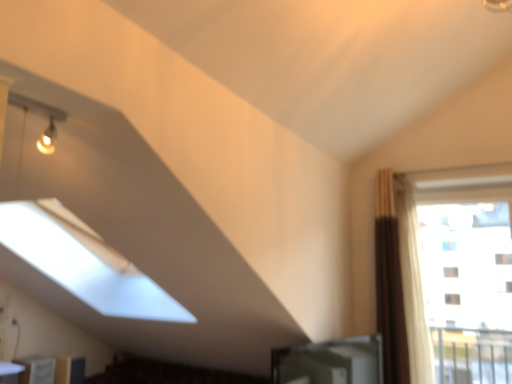
Locate an element on the screen. The image size is (512, 384). matte wood cabinet at lower left, marked as the second furniture in a front-to-back arrangement is located at coordinates (70, 370).

What do you see at coordinates (10, 372) in the screenshot?
I see `white glossy table at lower left` at bounding box center [10, 372].

At what (x,y) coordinates should I click in order to perform the action: click on matte wood cabinet at lower left, marked as the second furniture in a front-to-back arrangement. Please return your answer as a coordinate pair (x, y). The height and width of the screenshot is (384, 512). Looking at the image, I should click on (70, 370).

Could you measure the distance between white glossy bookshelf at lower left, placed as the first furniture when sorted from front to back, and matte wood cabinet at lower left, marked as the second furniture in a front-to-back arrangement?

white glossy bookshelf at lower left, placed as the first furniture when sorted from front to back, is 25.41 inches from matte wood cabinet at lower left, marked as the second furniture in a front-to-back arrangement.

From the image's perspective, between white glossy bookshelf at lower left, placed as the first furniture when sorted from front to back, and matte wood cabinet at lower left, marked as the second furniture in a front-to-back arrangement, who is located below?

matte wood cabinet at lower left, marked as the second furniture in a front-to-back arrangement.

Who is more distant, white glossy bookshelf at lower left, placed as the second furniture when sorted from back to front, or matte wood cabinet at lower left, acting as the first furniture starting from the back?

matte wood cabinet at lower left, acting as the first furniture starting from the back, is further from the camera.

Is white glossy bookshelf at lower left, placed as the second furniture when sorted from back to front, bigger than matte wood cabinet at lower left, acting as the first furniture starting from the back?

Actually, white glossy bookshelf at lower left, placed as the second furniture when sorted from back to front, might be smaller than matte wood cabinet at lower left, acting as the first furniture starting from the back.

Considering the sizes of objects white glossy bookshelf at lower left, placed as the first furniture when sorted from front to back, and transparent glass window at right in the image provided, who is taller, white glossy bookshelf at lower left, placed as the first furniture when sorted from front to back, or transparent glass window at right?

transparent glass window at right is taller.

Looking at this image, choose the correct answer: Is white glossy bookshelf at lower left, placed as the second furniture when sorted from back to front, inside transparent glass window at right or outside it?

white glossy bookshelf at lower left, placed as the second furniture when sorted from back to front, is not inside transparent glass window at right, it's outside.

Does white glossy bookshelf at lower left, placed as the second furniture when sorted from back to front, have a lesser width compared to transparent glass window at right?

Incorrect, the width of white glossy bookshelf at lower left, placed as the second furniture when sorted from back to front, is not less than that of transparent glass window at right.

How different are the orientations of white glossy bookshelf at lower left, placed as the first furniture when sorted from front to back, and transparent glass window at right in degrees?

They differ by 90 degrees in their facing directions.

Is matte wood cabinet at lower left, marked as the second furniture in a front-to-back arrangement, turned away from white glossy bookshelf at lower left, placed as the second furniture when sorted from back to front?

No, white glossy bookshelf at lower left, placed as the second furniture when sorted from back to front, is not at the back of matte wood cabinet at lower left, marked as the second furniture in a front-to-back arrangement.

Which object is positioned more to the right, matte wood cabinet at lower left, acting as the first furniture starting from the back, or white glossy bookshelf at lower left, placed as the second furniture when sorted from back to front?

matte wood cabinet at lower left, acting as the first furniture starting from the back.

Between matte wood cabinet at lower left, marked as the second furniture in a front-to-back arrangement, and white glossy bookshelf at lower left, placed as the first furniture when sorted from front to back, which one has less height?

white glossy bookshelf at lower left, placed as the first furniture when sorted from front to back, is shorter.

From the image's perspective, between matte wood cabinet at lower left, acting as the first furniture starting from the back, and white glossy bookshelf at lower left, placed as the first furniture when sorted from front to back, who is located below?

From the image's view, matte wood cabinet at lower left, acting as the first furniture starting from the back, is below.

Is white glossy table at lower left in contact with matte wood cabinet at lower left, acting as the first furniture starting from the back?

white glossy table at lower left and matte wood cabinet at lower left, acting as the first furniture starting from the back, are clearly separated.

Considering the relative positions of white glossy table at lower left and matte wood cabinet at lower left, marked as the second furniture in a front-to-back arrangement, in the image provided, is white glossy table at lower left to the left or to the right of matte wood cabinet at lower left, marked as the second furniture in a front-to-back arrangement,?

Clearly, white glossy table at lower left is on the left of matte wood cabinet at lower left, marked as the second furniture in a front-to-back arrangement, in the image.

From a real-world perspective, which object stands above the other?

In real-world perspective, white glossy table at lower left is above.

Can you tell me how much brown fabric curtain at right and white glossy bookshelf at lower left, placed as the second furniture when sorted from back to front, differ in facing direction?

They differ by 90 degrees in their facing directions.

Considering the relative sizes of brown fabric curtain at right and white glossy bookshelf at lower left, placed as the first furniture when sorted from front to back, in the image provided, is brown fabric curtain at right thinner than white glossy bookshelf at lower left, placed as the first furniture when sorted from front to back,?

Indeed, brown fabric curtain at right has a lesser width compared to white glossy bookshelf at lower left, placed as the first furniture when sorted from front to back.

Is brown fabric curtain at right positioned before white glossy bookshelf at lower left, placed as the second furniture when sorted from back to front?

No.

Is brown fabric curtain at right next to white glossy bookshelf at lower left, placed as the second furniture when sorted from back to front, and touching it?

brown fabric curtain at right is not next to white glossy bookshelf at lower left, placed as the second furniture when sorted from back to front, and they're not touching.

How different are the orientations of brown fabric curtain at right and matte wood cabinet at lower left, marked as the second furniture in a front-to-back arrangement, in degrees?

They differ by 90 degrees in their facing directions.

Is point (393, 229) closer to viewer compared to point (69, 380)?

Yes, it is.

Is brown fabric curtain at right bigger or smaller than matte wood cabinet at lower left, marked as the second furniture in a front-to-back arrangement?

Clearly, brown fabric curtain at right is larger in size than matte wood cabinet at lower left, marked as the second furniture in a front-to-back arrangement.

Could you tell me if brown fabric curtain at right is facing matte wood cabinet at lower left, acting as the first furniture starting from the back?

No, brown fabric curtain at right is not oriented towards matte wood cabinet at lower left, acting as the first furniture starting from the back.

From the image's perspective, is white glossy bookshelf at lower left, placed as the second furniture when sorted from back to front, beneath brown fabric curtain at right?

Yes.

Can you confirm if white glossy bookshelf at lower left, placed as the second furniture when sorted from back to front, is wider than brown fabric curtain at right?

Yes.

From a real-world perspective, which is physically above, white glossy bookshelf at lower left, placed as the first furniture when sorted from front to back, or brown fabric curtain at right?

From a 3D spatial view, brown fabric curtain at right is above.

Find the location of a particular element. This screenshot has height=384, width=512. furniture above the matte wood cabinet at lower left, acting as the first furniture starting from the back (from a real-world perspective) is located at coordinates (36, 369).

What are the coordinates of `furniture that is the 2nd one when counting leftward from the transparent glass window at right` in the screenshot? It's located at (36, 369).

Considering their positions, is white glossy table at lower left positioned further to brown fabric curtain at right than transparent glass window at right?

white glossy table at lower left is further to brown fabric curtain at right.

Estimate the real-world distances between objects in this image. Which object is further from white glossy bookshelf at lower left, placed as the second furniture when sorted from back to front, matte wood cabinet at lower left, marked as the second furniture in a front-to-back arrangement, or white glossy table at lower left?

matte wood cabinet at lower left, marked as the second furniture in a front-to-back arrangement, is positioned further to the anchor white glossy bookshelf at lower left, placed as the second furniture when sorted from back to front.

Which object lies nearer to the anchor point white glossy bookshelf at lower left, placed as the second furniture when sorted from back to front, brown fabric curtain at right or matte wood cabinet at lower left, marked as the second furniture in a front-to-back arrangement?

Among the two, matte wood cabinet at lower left, marked as the second furniture in a front-to-back arrangement, is located nearer to white glossy bookshelf at lower left, placed as the second furniture when sorted from back to front.

Looking at the image, which one is located closer to transparent glass window at right, white glossy table at lower left or matte wood cabinet at lower left, acting as the first furniture starting from the back?

The object closer to transparent glass window at right is matte wood cabinet at lower left, acting as the first furniture starting from the back.

Considering their positions, is transparent glass window at right positioned further to white glossy table at lower left than white glossy bookshelf at lower left, placed as the second furniture when sorted from back to front?

transparent glass window at right is further to white glossy table at lower left.

Looking at the image, which one is located closer to white glossy bookshelf at lower left, placed as the second furniture when sorted from back to front, brown fabric curtain at right or transparent glass window at right?

brown fabric curtain at right lies closer to white glossy bookshelf at lower left, placed as the second furniture when sorted from back to front, than the other object.

Considering their positions, is white glossy table at lower left positioned further to transparent glass window at right than brown fabric curtain at right?

The object further to transparent glass window at right is white glossy table at lower left.

Looking at the image, which one is located closer to matte wood cabinet at lower left, marked as the second furniture in a front-to-back arrangement, white glossy bookshelf at lower left, placed as the second furniture when sorted from back to front, or white glossy table at lower left?

white glossy bookshelf at lower left, placed as the second furniture when sorted from back to front, is positioned closer to the anchor matte wood cabinet at lower left, marked as the second furniture in a front-to-back arrangement.

This screenshot has height=384, width=512. What are the coordinates of `curtain between white glossy bookshelf at lower left, placed as the second furniture when sorted from back to front, and transparent glass window at right from left to right` in the screenshot? It's located at (390, 280).

The image size is (512, 384). Identify the location of curtain between matte wood cabinet at lower left, acting as the first furniture starting from the back, and transparent glass window at right from left to right. [390, 280].

I want to click on furniture located between white glossy bookshelf at lower left, placed as the second furniture when sorted from back to front, and transparent glass window at right in the left-right direction, so click(x=70, y=370).

In order to click on curtain situated between white glossy table at lower left and transparent glass window at right from left to right in this screenshot , I will do `click(390, 280)`.